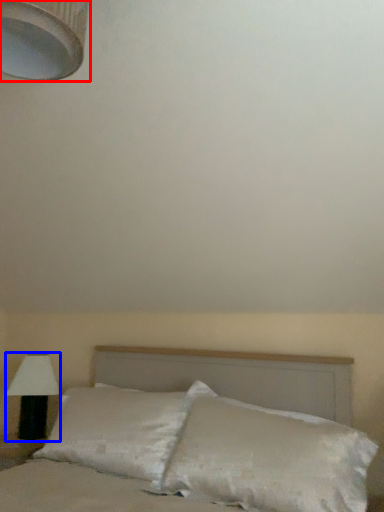
Question: Which point is further to the camera, lamp (highlighted by a red box) or lamp (highlighted by a blue box)?

Choices:
 (A) lamp
 (B) lamp

Answer: (B)